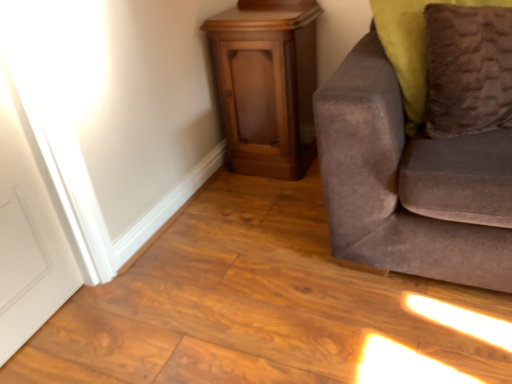
Locate an element on the screen. This screenshot has width=512, height=384. vacant space that is in between wooden cabinet at center and suede gray couch at right is located at coordinates (279, 214).